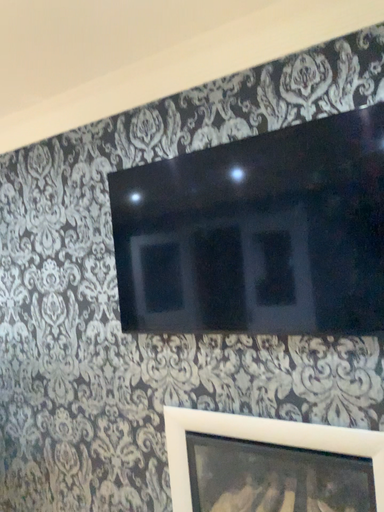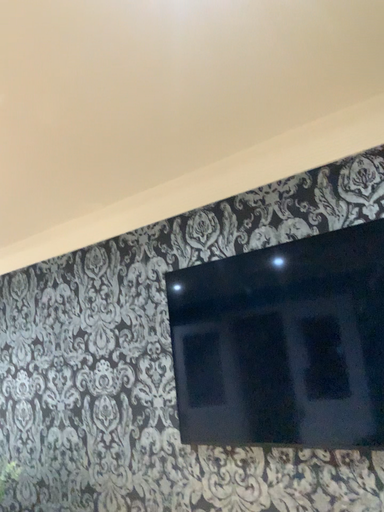
Question: How did the camera likely rotate when shooting the video?

Choices:
 (A) rotated upward
 (B) rotated downward

Answer: (A)